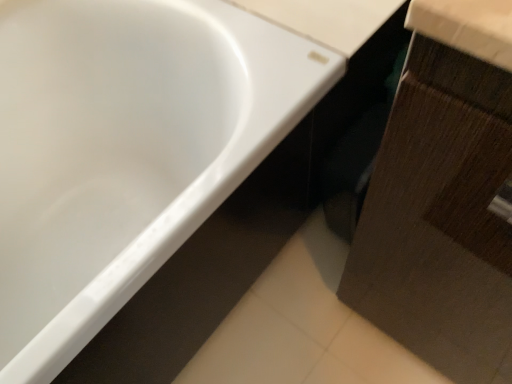
Question: From a real-world perspective, relative to white glossy bathtub at upper left, is brown wood cabinet at lower right vertically above or below?

Choices:
 (A) below
 (B) above

Answer: (B)

Question: From the image's perspective, is brown wood cabinet at lower right located above or below white glossy bathtub at upper left?

Choices:
 (A) below
 (B) above

Answer: (A)

Question: In terms of width, does brown wood cabinet at lower right look wider or thinner when compared to white glossy bathtub at upper left?

Choices:
 (A) thin
 (B) wide

Answer: (A)

Question: From the image's perspective, is white glossy bathtub at upper left located above or below brown wood cabinet at lower right?

Choices:
 (A) below
 (B) above

Answer: (B)

Question: From a real-world perspective, is white glossy bathtub at upper left positioned above or below brown wood cabinet at lower right?

Choices:
 (A) above
 (B) below

Answer: (B)

Question: In the image, is white glossy bathtub at upper left on the left side or the right side of brown wood cabinet at lower right?

Choices:
 (A) right
 (B) left

Answer: (B)

Question: Does point (97, 279) appear closer or farther from the camera than point (487, 276)?

Choices:
 (A) farther
 (B) closer

Answer: (B)